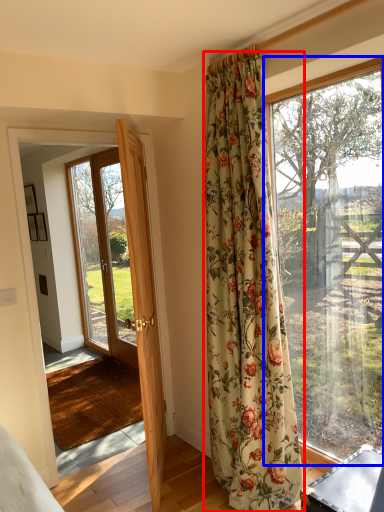
Question: Among these objects, which one is farthest to the camera, curtain (highlighted by a red box) or window (highlighted by a blue box)?

Choices:
 (A) curtain
 (B) window

Answer: (B)